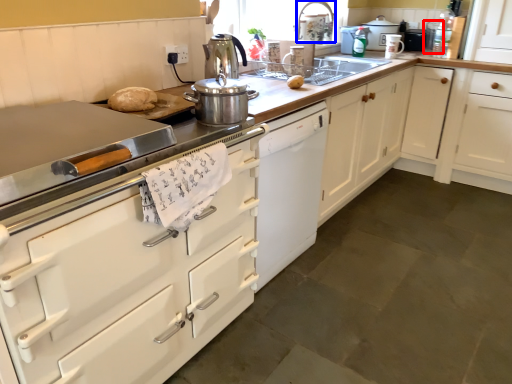
Question: Among these objects, which one is farthest to the camera, appliance (highlighted by a red box) or faucet (highlighted by a blue box)?

Choices:
 (A) appliance
 (B) faucet

Answer: (A)